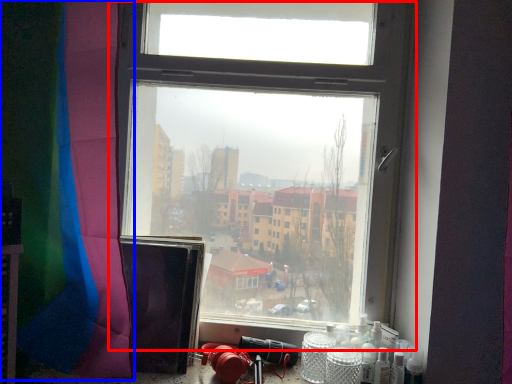
Question: Which object is closer to the camera taking this photo, window (highlighted by a red box) or curtain (highlighted by a blue box)?

Choices:
 (A) window
 (B) curtain

Answer: (B)